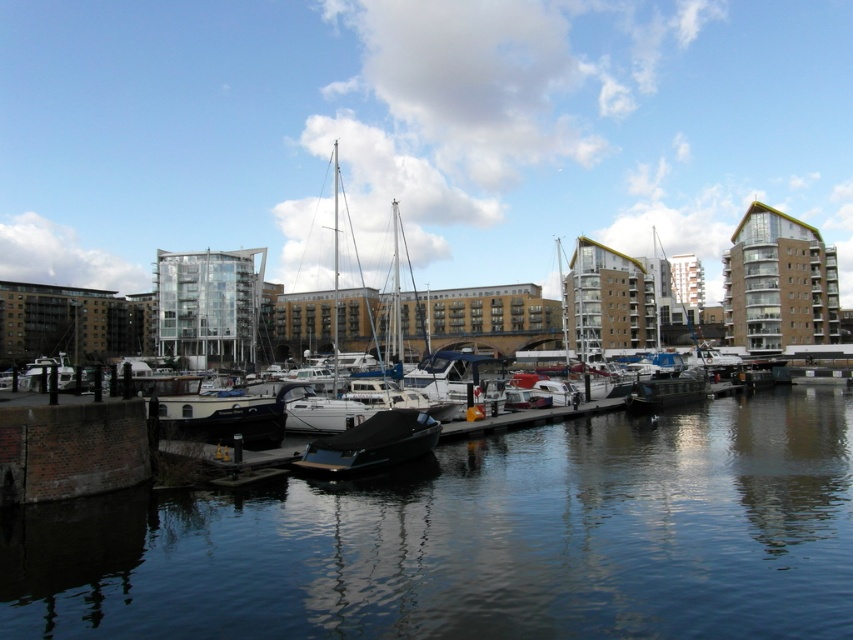
Question: Does smooth dark water at center have a lesser width compared to shiny black boat at center?

Choices:
 (A) no
 (B) yes

Answer: (A)

Question: Does smooth dark water at center have a smaller size compared to shiny black boat at center?

Choices:
 (A) yes
 (B) no

Answer: (B)

Question: Which object is farther from the camera taking this photo?

Choices:
 (A) shiny black boat at center
 (B) smooth dark water at center

Answer: (A)

Question: Which point is farther to the camera?

Choices:
 (A) (670, 483)
 (B) (415, 422)

Answer: (B)

Question: Is smooth dark water at center in front of shiny black boat at center?

Choices:
 (A) no
 (B) yes

Answer: (B)

Question: Which object appears closest to the camera in this image?

Choices:
 (A) shiny black boat at center
 (B) smooth dark water at center

Answer: (B)